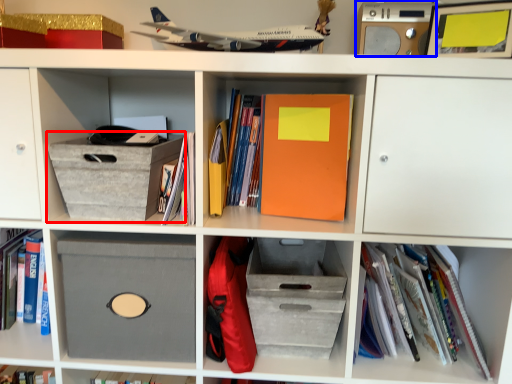
Question: Among these objects, which one is nearest to the camera, cardboard box (highlighted by a red box) or speaker (highlighted by a blue box)?

Choices:
 (A) cardboard box
 (B) speaker

Answer: (A)